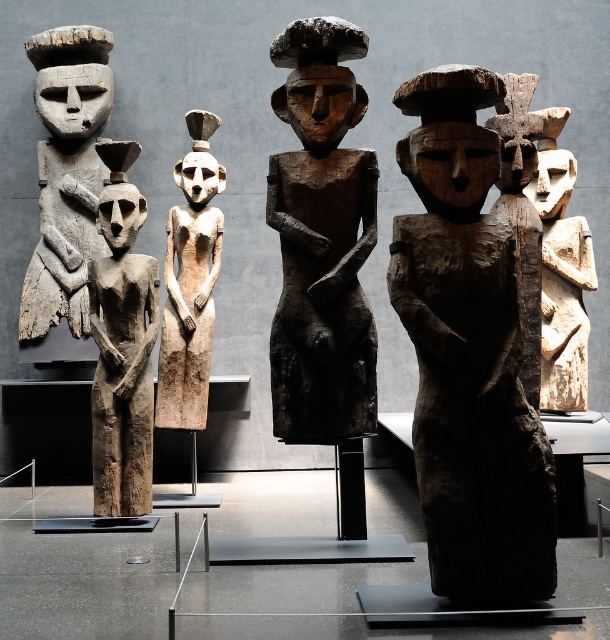
Does dark wood figure at center have a lesser height compared to light beige wood carving at right?

No, dark wood figure at center is not shorter than light beige wood carving at right.

Which is more to the left, dark wood figure at center or light beige wood carving at right?

dark wood figure at center is more to the left.

Describe the element at coordinates (468, 353) in the screenshot. I see `dark wood figure at center` at that location.

The image size is (610, 640). What are the coordinates of `dark wood figure at center` in the screenshot? It's located at (468, 353).

Is dark wood figure at center bigger than light brown wood figure at center?

Yes.

Is point (512, 529) closer to viewer compared to point (173, 282)?

Yes, point (512, 529) is in front of point (173, 282).

Locate an element on the screen. This screenshot has width=610, height=640. dark wood figure at center is located at coordinates (468, 353).

Does wooden statue at left have a larger size compared to wooden figure at center?

Indeed, wooden statue at left has a larger size compared to wooden figure at center.

Image resolution: width=610 pixels, height=640 pixels. What do you see at coordinates (66, 173) in the screenshot?
I see `wooden statue at left` at bounding box center [66, 173].

At what (x,y) coordinates should I click in order to perform the action: click on wooden statue at left. Please return your answer as a coordinate pair (x, y). This screenshot has height=640, width=610. Looking at the image, I should click on (66, 173).